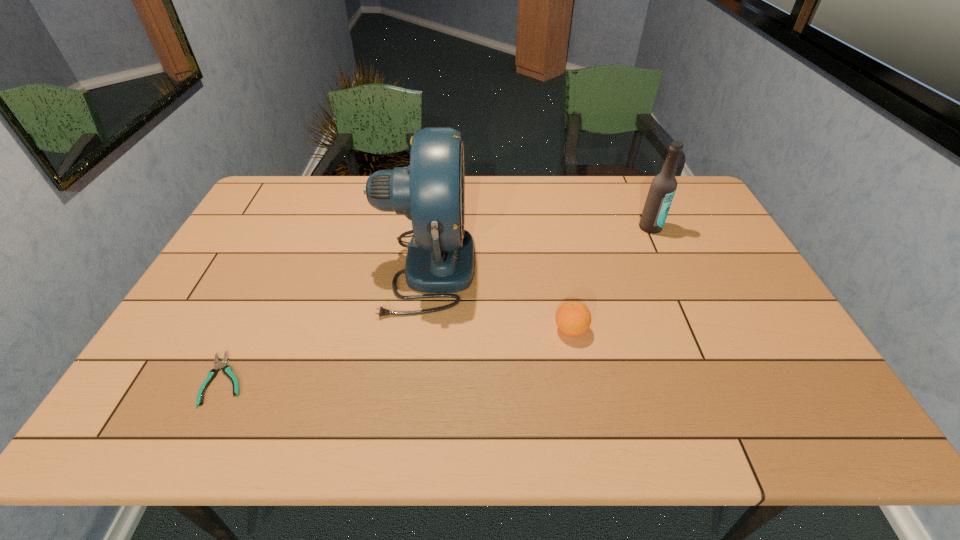
The image size is (960, 540). What are the coordinates of `vacant space situated 0.290m on the right of the third object from left to right` in the screenshot? It's located at (702, 329).

You are a GUI agent. You are given a task and a screenshot of the screen. Output one action in this format:
    pyautogui.click(x=<x>, y=<y>)
    Task: Click on the blank space located on the back of the pliers
    
    Given the screenshot: What is the action you would take?
    pyautogui.click(x=283, y=259)

Find the location of `object present at the near edge`. object present at the near edge is located at coordinates (226, 369).

Where is `object that is at the left edge`? object that is at the left edge is located at coordinates (226, 369).

I want to click on object at the near left corner, so click(226, 369).

This screenshot has height=540, width=960. Find the location of `free space at the far edge of the desktop`. free space at the far edge of the desktop is located at coordinates (535, 190).

I want to click on free location at the near edge of the desktop, so click(222, 438).

This screenshot has width=960, height=540. Identify the location of vacant space at the left edge of the desktop. (238, 238).

The image size is (960, 540). In order to click on vacant space at the right edge of the desktop in this screenshot , I will do `click(703, 228)`.

Locate an element on the screen. vacant area that lies between the rightmost object and the tallest object is located at coordinates (539, 247).